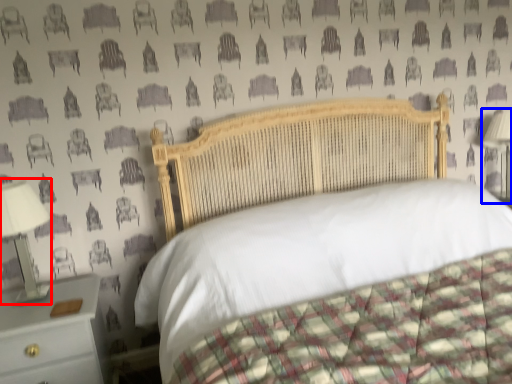
Question: Which object appears farthest to the camera in this image, bedside lamp (highlighted by a red box) or bedside lamp (highlighted by a blue box)?

Choices:
 (A) bedside lamp
 (B) bedside lamp

Answer: (B)